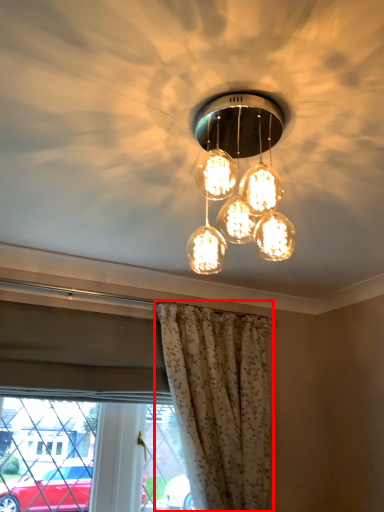
Question: From the image's perspective, where is curtain (annotated by the red box) located relative to lamp?

Choices:
 (A) below
 (B) above

Answer: (A)